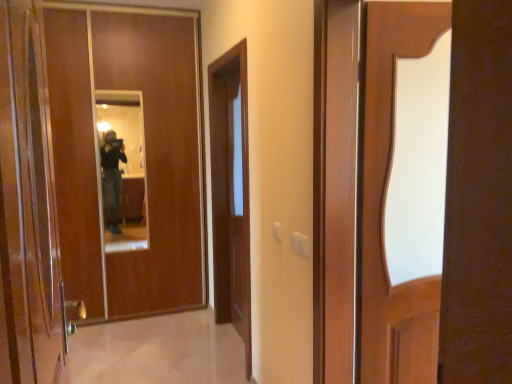
Question: From a real-world perspective, is shiny brown door at left, the 2th door positioned from the back, under brown wooden door at center?

Choices:
 (A) yes
 (B) no

Answer: (B)

Question: From a real-world perspective, is shiny brown door at left, the 1th door positioned from the front, physically above brown wooden door at center?

Choices:
 (A) yes
 (B) no

Answer: (A)

Question: Considering the relative sizes of shiny brown door at left, the 2th door positioned from the back, and brown wooden door at center in the image provided, is shiny brown door at left, the 2th door positioned from the back, shorter than brown wooden door at center?

Choices:
 (A) yes
 (B) no

Answer: (A)

Question: Considering the relative sizes of shiny brown door at left, the 1th door positioned from the front, and brown wooden door at center in the image provided, is shiny brown door at left, the 1th door positioned from the front, wider than brown wooden door at center?

Choices:
 (A) no
 (B) yes

Answer: (A)

Question: Is shiny brown door at left, the 1th door positioned from the front, surrounding brown wooden door at center?

Choices:
 (A) yes
 (B) no

Answer: (B)

Question: In terms of size, does brown wooden door at center appear bigger or smaller than shiny brown door at left, the 1th door positioned from the front?

Choices:
 (A) small
 (B) big

Answer: (B)

Question: From the image's perspective, is brown wooden door at center positioned above or below shiny brown door at left, the 2th door positioned from the back?

Choices:
 (A) below
 (B) above

Answer: (A)

Question: From their relative heights in the image, would you say brown wooden door at center is taller or shorter than shiny brown door at left, the 1th door positioned from the front?

Choices:
 (A) tall
 (B) short

Answer: (A)

Question: Does point (223, 110) appear closer or farther from the camera than point (39, 127)?

Choices:
 (A) closer
 (B) farther

Answer: (B)

Question: Based on their sizes in the image, would you say shiny brown door at left, the 1th door positioned from the front, is bigger or smaller than brown wooden door at center?

Choices:
 (A) small
 (B) big

Answer: (A)

Question: From a real-world perspective, is shiny brown door at left, the 2th door positioned from the back, physically located above or below brown wooden door at center?

Choices:
 (A) above
 (B) below

Answer: (A)

Question: Does point (41, 266) appear closer or farther from the camera than point (222, 225)?

Choices:
 (A) closer
 (B) farther

Answer: (A)

Question: In terms of height, does shiny brown door at left, the 2th door positioned from the back, look taller or shorter compared to brown wooden door at center?

Choices:
 (A) short
 (B) tall

Answer: (A)

Question: Is matte wooden mirror at center in front of or behind brown wooden door at center in the image?

Choices:
 (A) front
 (B) behind

Answer: (B)

Question: Would you say matte wooden mirror at center is to the left or to the right of brown wooden door at center in the picture?

Choices:
 (A) right
 (B) left

Answer: (B)